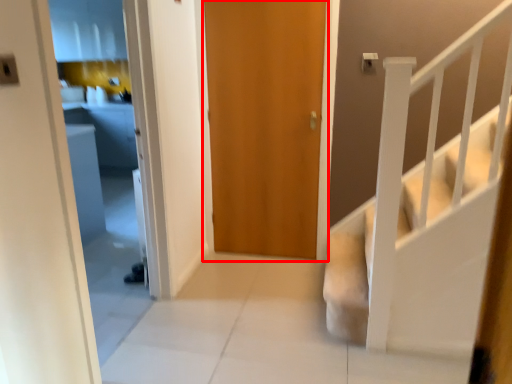
Question: Observing the image, what is the correct spatial positioning of door (annotated by the red box) in reference to stairs?

Choices:
 (A) left
 (B) right

Answer: (A)